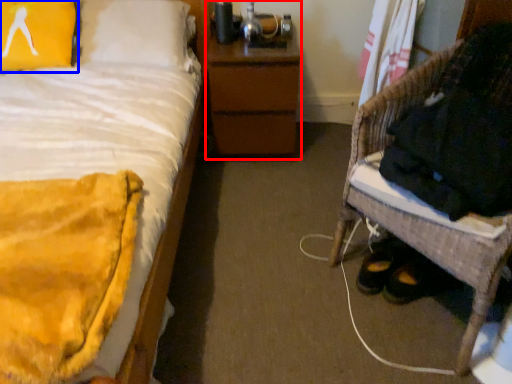
Question: Which of the following is the farthest to the observer, nightstand (highlighted by a red box) or pillow (highlighted by a blue box)?

Choices:
 (A) nightstand
 (B) pillow

Answer: (A)